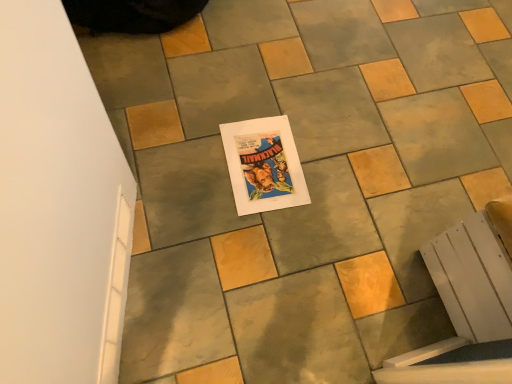
Where is `free space in front of vibrant paper comic book at center`? The width and height of the screenshot is (512, 384). free space in front of vibrant paper comic book at center is located at coordinates (x=244, y=243).